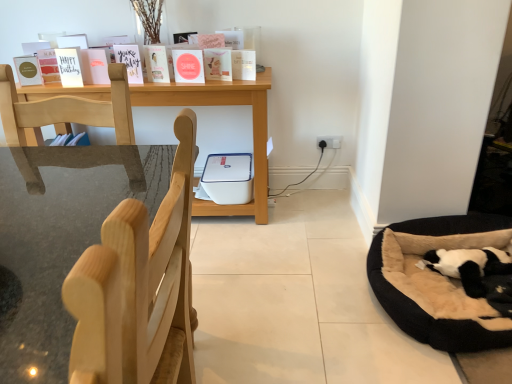
Image resolution: width=512 pixels, height=384 pixels. Identify the location of vacant area that is in front of wooden table at center. (246, 290).